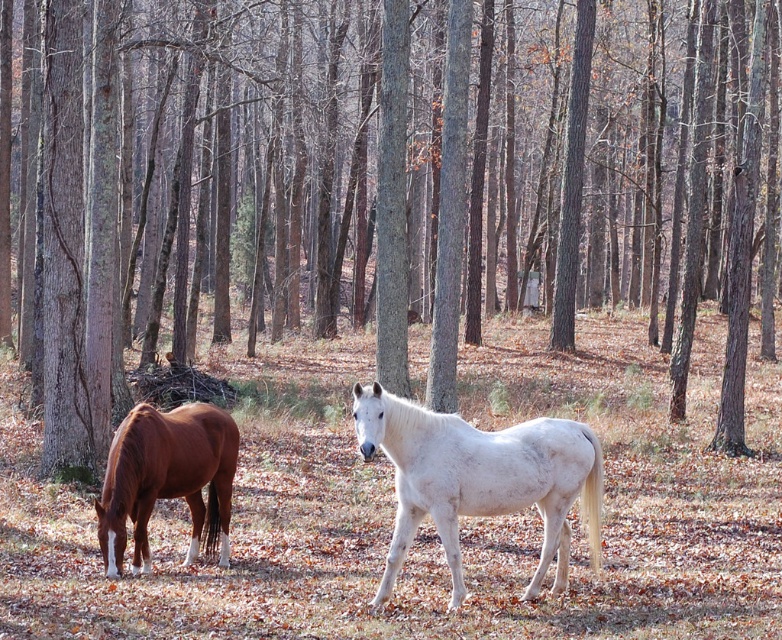
Is brown grass at center smaller than brown glossy horse at left?

No, brown grass at center is not smaller than brown glossy horse at left.

Is brown grass at center above brown glossy horse at left?

Yes, brown grass at center is above brown glossy horse at left.

Which is behind, point (332, 378) or point (224, 416)?

The point (332, 378) is more distant.

The image size is (782, 640). Find the location of `brown grass at center`. brown grass at center is located at coordinates click(427, 516).

Is white matte horse at center to the right of brown glossy horse at left from the viewer's perspective?

Yes, white matte horse at center is to the right of brown glossy horse at left.

The height and width of the screenshot is (640, 782). I want to click on white matte horse at center, so click(479, 480).

Is point (474, 376) positioned before point (458, 497)?

No, it is behind (458, 497).

Identify the location of brown grass at center. Image resolution: width=782 pixels, height=640 pixels. (427, 516).